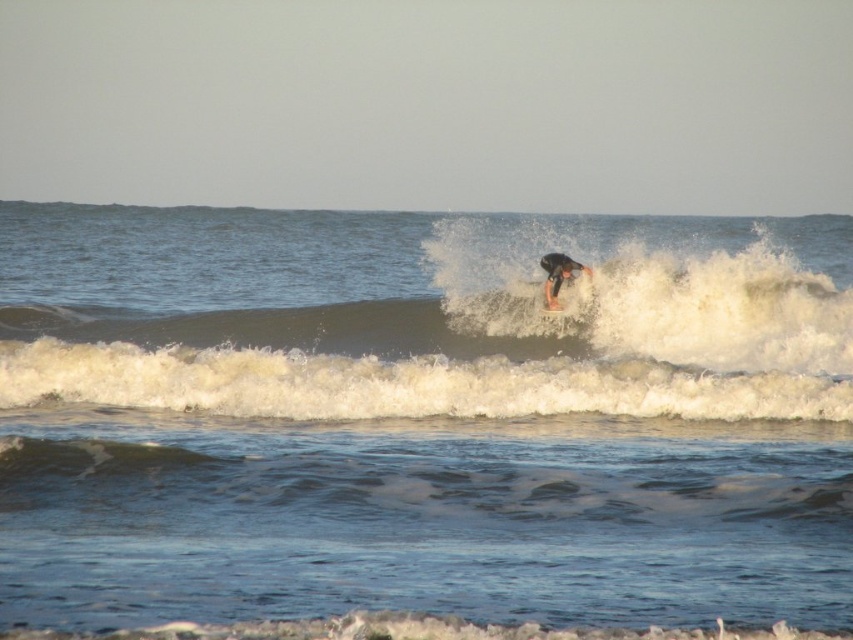
You are a photographer trying to capture the surfer and the surfboard in a single shot. Given that the black wetsuit surfer at center is much taller than the white foam surfboard at center, which object should you focus on to ensure both are in frame without cropping?

Since the black wetsuit surfer at center is much taller than the white foam surfboard at center, you should focus on the white foam surfboard at center to ensure both fit in the frame without cropping, as it is smaller and positioned centrally.

You are a drone operator trying to capture the surfer in the center. Given the coordinates of the black wetsuit surfer at center as point 0.431, 0.655, where should the drone focus its camera to ensure the surfer is centered in the frame?

The drone should focus its camera on the coordinates (558, 275) to center the black wetsuit surfer at center in the frame.